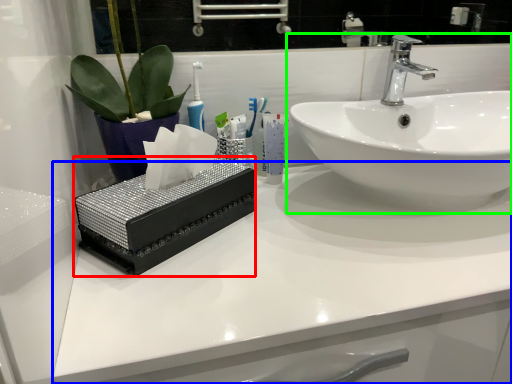
Question: Estimate the real-world distances between objects in this image. Which object is farther from box (highlighted by a red box), counter top (highlighted by a blue box) or sink (highlighted by a green box)?

Choices:
 (A) counter top
 (B) sink

Answer: (B)